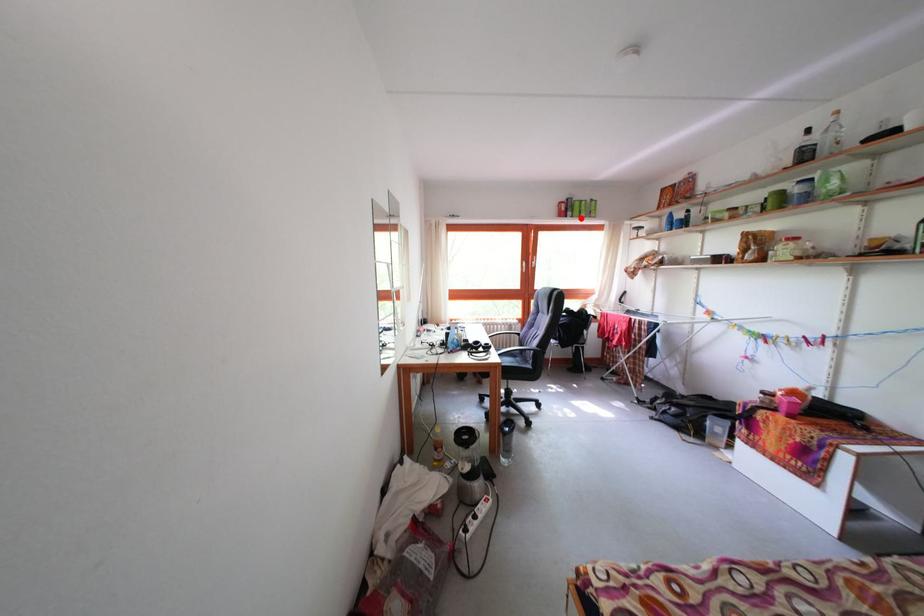
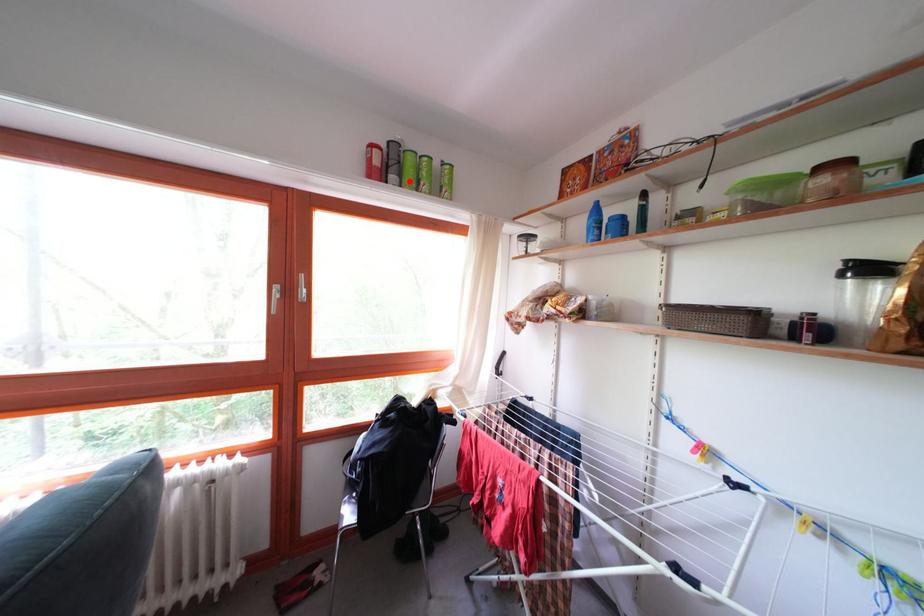
I am providing you with two images of the same scene from different viewpoints. A red point is marked on the first image and another point is marked on the second image. Are the points marked in image1 and image2 representing the same 3D position?

Yes